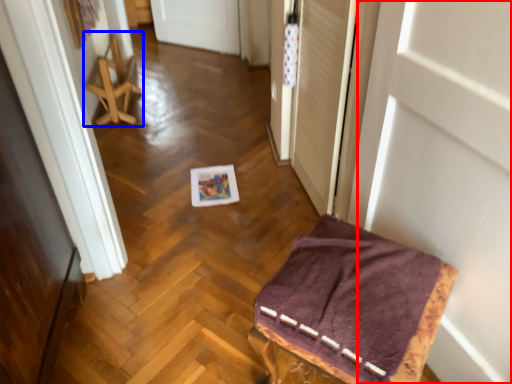
Question: Which of the following is the farthest to the observer, door (highlighted by a red box) or furniture (highlighted by a blue box)?

Choices:
 (A) door
 (B) furniture

Answer: (B)